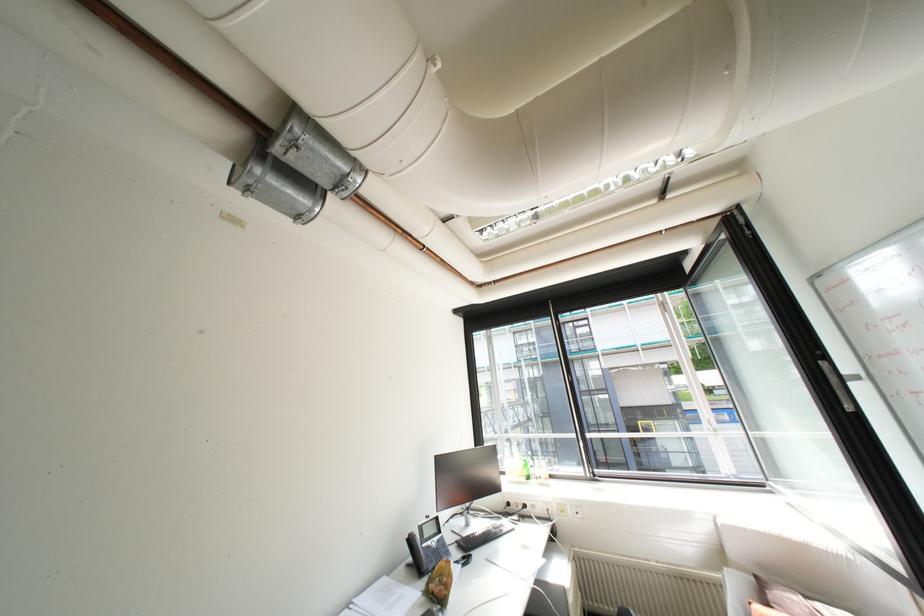
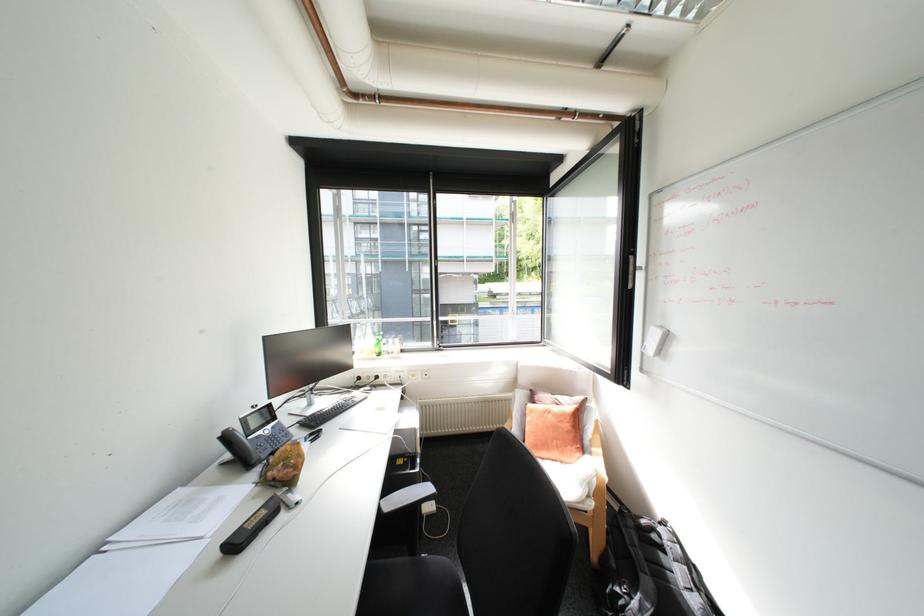
Locate, in the second image, the point that corresponds to (x=514, y=474) in the first image.

(362, 353)